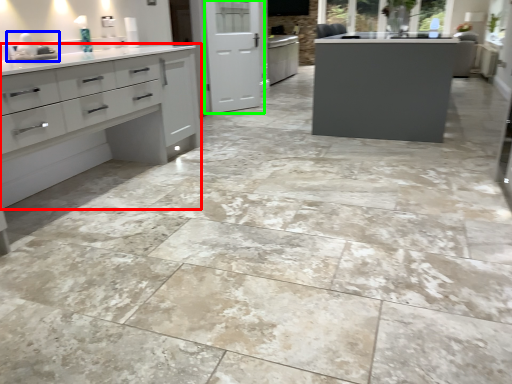
Question: Estimate the real-world distances between objects in this image. Which object is farther from cupboard (highlighted by a red box), sink (highlighted by a blue box) or screen door (highlighted by a green box)?

Choices:
 (A) sink
 (B) screen door

Answer: (B)